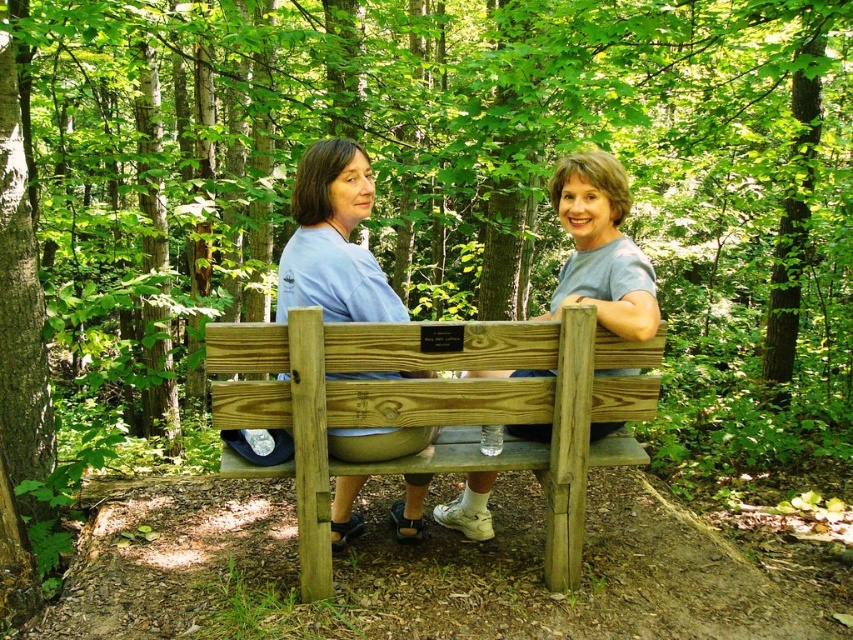
Does wooden bench at center have a lesser height compared to gray matte wood bench at center?

Incorrect, wooden bench at center's height does not fall short of gray matte wood bench at center's.

Which is in front, point (454, 326) or point (643, 296)?

Positioned in front is point (454, 326).

Locate an element on the screen. Image resolution: width=853 pixels, height=640 pixels. wooden bench at center is located at coordinates (436, 410).

Does wooden bench at center lie behind matte blue shirt at center?

That is False.

Consider the image. Which of these two, wooden bench at center or matte blue shirt at center, stands shorter?

With less height is wooden bench at center.

Is point (601, 358) closer to camera compared to point (296, 252)?

That is True.

This screenshot has width=853, height=640. What are the coordinates of `wooden bench at center` in the screenshot? It's located at (436, 410).

The height and width of the screenshot is (640, 853). What do you see at coordinates (334, 241) in the screenshot?
I see `matte blue shirt at center` at bounding box center [334, 241].

Who is shorter, matte blue shirt at center or gray matte wood bench at center?

gray matte wood bench at center is shorter.

Does point (413, 442) lie behind point (566, 301)?

That is True.

At what (x,y) coordinates should I click in order to perform the action: click on matte blue shirt at center. Please return your answer as a coordinate pair (x, y). Looking at the image, I should click on (334, 241).